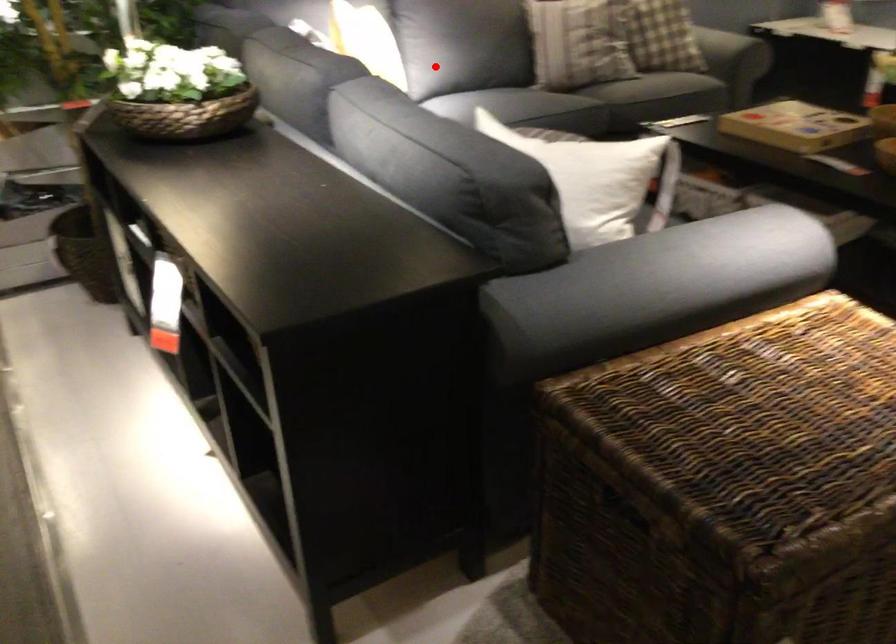
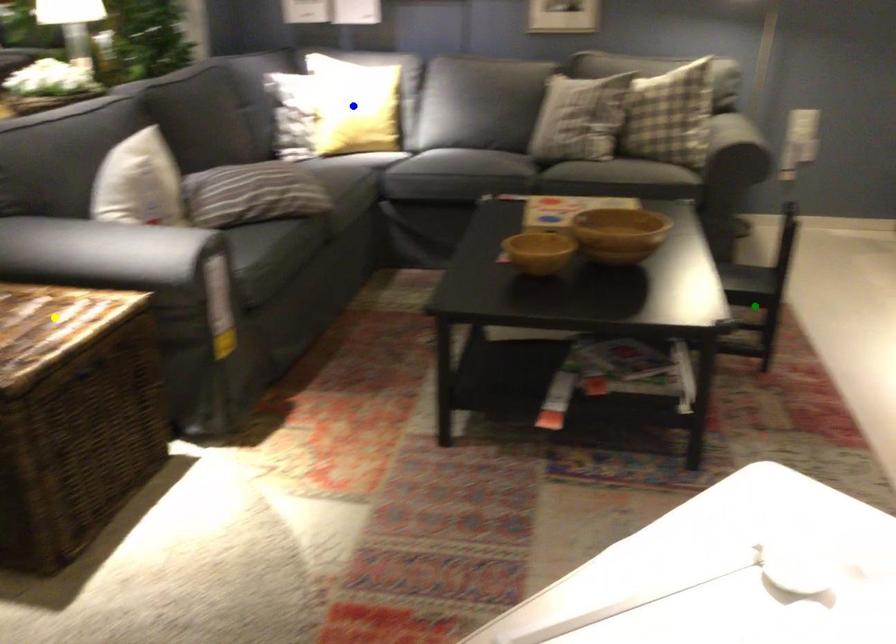
Question: I am providing you with two images of the same scene from different viewpoints. A red point is marked on the first image. You are given multiple points on the second image. In image 2, which mark is for the same physical point as the one in image 1?

Choices:
 (A) yellow point
 (B) blue point
 (C) green point

Answer: (B)